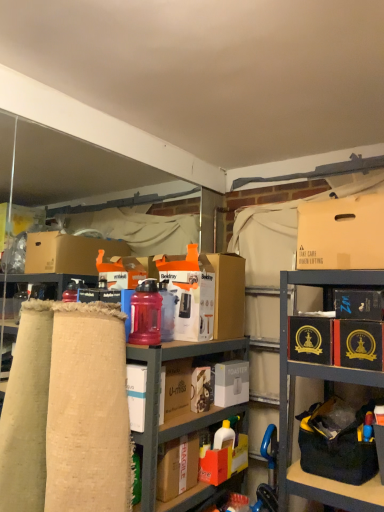
Question: Is matte cardboard boxes at center, which is the 2th cabinetry in top-to-bottom order, facing towards black cardboard box at upper right, placed as the 3th box when sorted from top to bottom?

Choices:
 (A) yes
 (B) no

Answer: (A)

Question: Does matte cardboard boxes at center, the first cabinetry positioned from the bottom, have a smaller size compared to black cardboard box at upper right, which ranks as the fifth box in bottom-to-top order?

Choices:
 (A) no
 (B) yes

Answer: (A)

Question: Does matte cardboard boxes at center, the first cabinetry positioned from the bottom, appear on the right side of black cardboard box at upper right, which ranks as the fifth box in bottom-to-top order?

Choices:
 (A) yes
 (B) no

Answer: (B)

Question: Is the depth of matte cardboard boxes at center, the first cabinetry positioned from the bottom, less than that of black cardboard box at upper right, placed as the 3th box when sorted from top to bottom?

Choices:
 (A) no
 (B) yes

Answer: (B)

Question: Would you say black cardboard box at upper right, which ranks as the fifth box in bottom-to-top order, is part of matte cardboard boxes at center, which is the 2th cabinetry in top-to-bottom order,'s contents?

Choices:
 (A) no
 (B) yes

Answer: (A)

Question: From the image's perspective, is matte cardboard boxes at center, the first cabinetry positioned from the bottom, below black cardboard box at upper right, which ranks as the fifth box in bottom-to-top order?

Choices:
 (A) no
 (B) yes

Answer: (B)

Question: Does matte cardboard boxes at center, which is the 2th cabinetry in top-to-bottom order, have a lesser width compared to translucent plastic water bottle at center?

Choices:
 (A) yes
 (B) no

Answer: (B)

Question: Does matte cardboard boxes at center, the first cabinetry positioned from the bottom, come behind translucent plastic water bottle at center?

Choices:
 (A) yes
 (B) no

Answer: (B)

Question: Does matte cardboard boxes at center, the first cabinetry positioned from the bottom, have a greater height compared to translucent plastic water bottle at center?

Choices:
 (A) no
 (B) yes

Answer: (B)

Question: Does matte cardboard boxes at center, which is the 2th cabinetry in top-to-bottom order, have a lesser height compared to translucent plastic water bottle at center?

Choices:
 (A) yes
 (B) no

Answer: (B)

Question: Can translucent plastic water bottle at center be found inside matte cardboard boxes at center, which is the 2th cabinetry in top-to-bottom order?

Choices:
 (A) yes
 (B) no

Answer: (B)

Question: Is matte cardboard boxes at center, the first cabinetry positioned from the bottom, in contact with translucent plastic water bottle at center?

Choices:
 (A) no
 (B) yes

Answer: (A)

Question: Could you tell me if black cardboard box at upper right, placed as the 3th box when sorted from top to bottom, is turned towards matte cardboard box at upper right, placed as the seventh box when sorted from bottom to top?

Choices:
 (A) no
 (B) yes

Answer: (A)